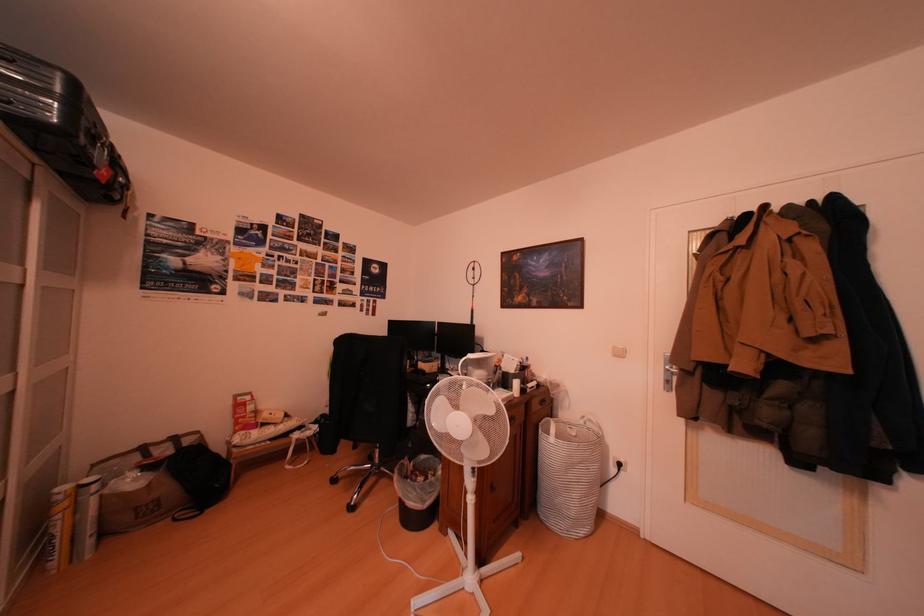
Find where to pull the laundry basket handle. Please return your answer as a coordinate pair (x, y).

(548, 428)